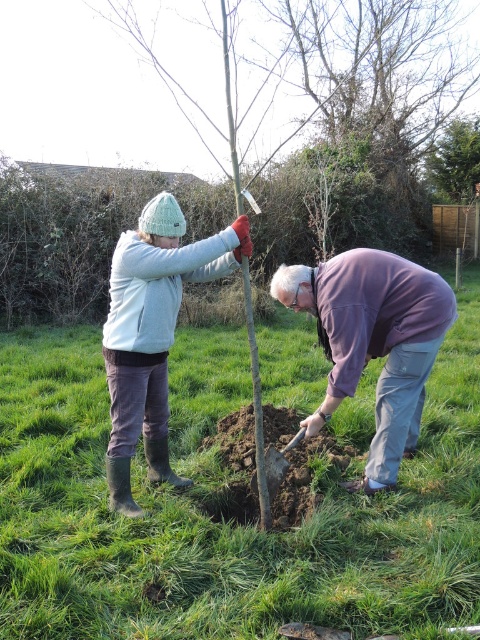
You are standing at the origin of the coordinate system in the image. You want to move towards the point at coordinate point (369, 333). What object are you moving towards?

You are moving towards the matte gray sweater at center, which is located at coordinate point (369, 333).